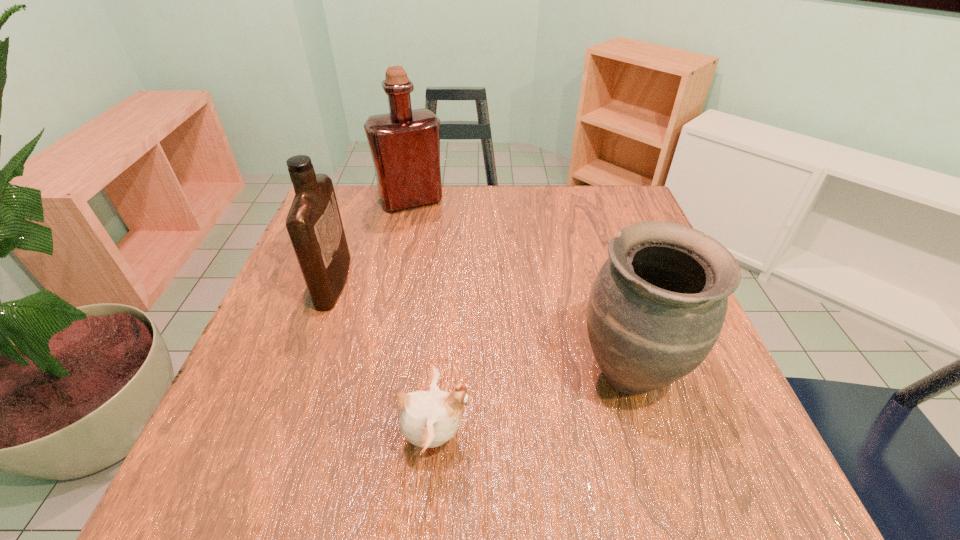
Where is `the taller liquor`? Image resolution: width=960 pixels, height=540 pixels. the taller liquor is located at coordinates (405, 144).

This screenshot has height=540, width=960. What are the coordinates of `the farthest object` in the screenshot? It's located at (405, 144).

Where is `the left liquor`? the left liquor is located at coordinates (314, 225).

Where is `the third nearest object`? the third nearest object is located at coordinates (314, 225).

This screenshot has height=540, width=960. Find the location of `the rightmost object`. the rightmost object is located at coordinates (657, 306).

Locate an element on the screen. The width and height of the screenshot is (960, 540). the shortest object is located at coordinates (428, 419).

This screenshot has height=540, width=960. I want to click on free space located on the right of the right liquor, so click(543, 200).

Locate an element on the screen. The image size is (960, 540). blank area located on the label side of the leftmost object is located at coordinates (401, 282).

Identify the location of free space located on the back of the rightmost object. (595, 260).

The image size is (960, 540). Identify the location of free space located 0.380m at the beak of the shortest object. (714, 437).